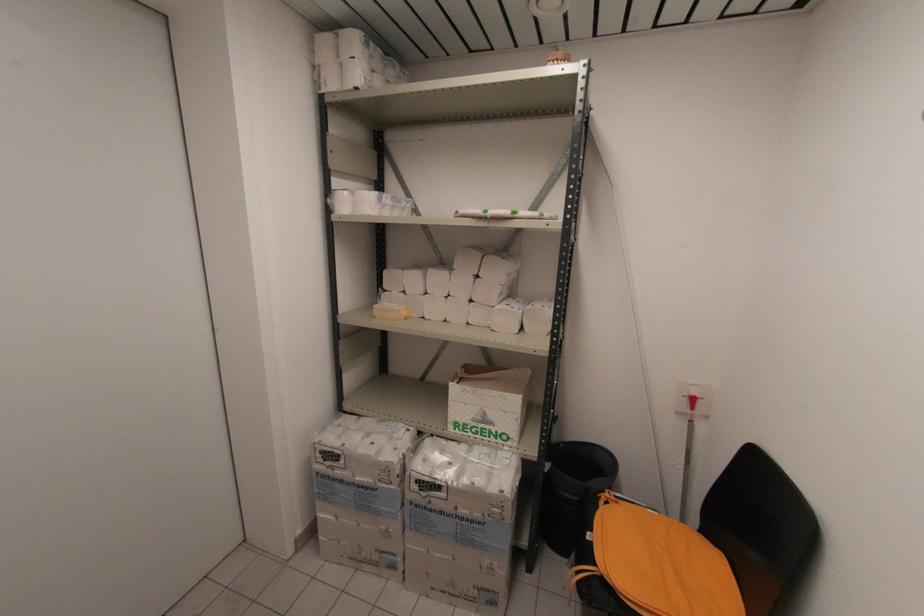
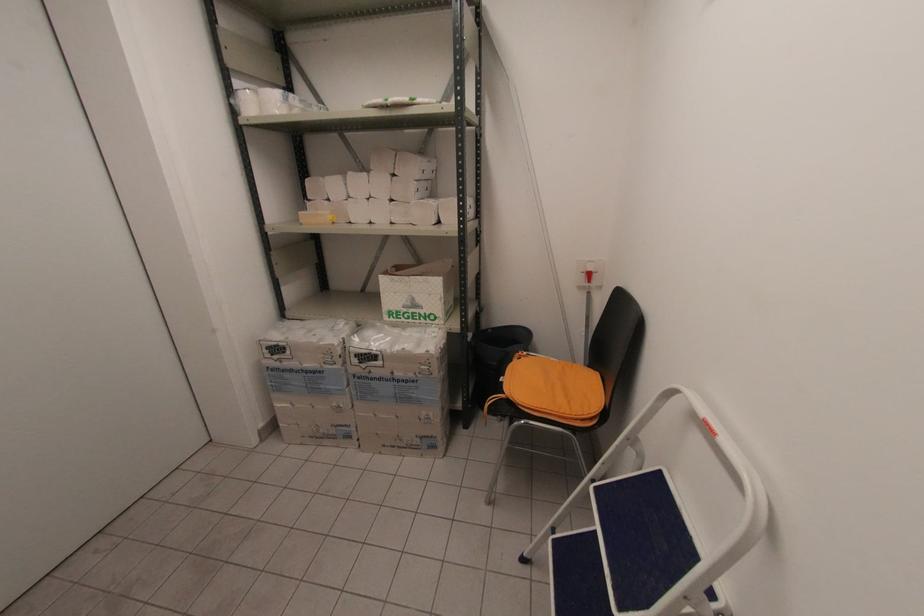
Question: How did the camera likely rotate?

Choices:
 (A) Left
 (B) Right
 (C) Up
 (D) Down

Answer: (D)